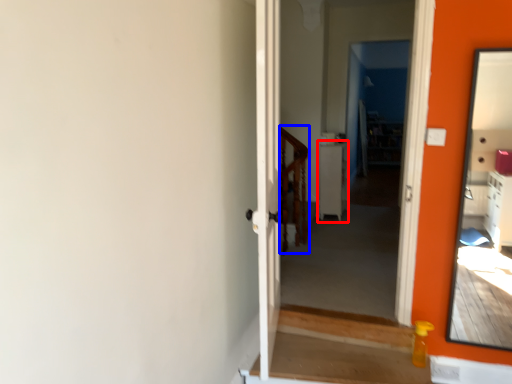
Question: Which point is further to the camera, table (highlighted by a red box) or balustrade (highlighted by a blue box)?

Choices:
 (A) table
 (B) balustrade

Answer: (A)